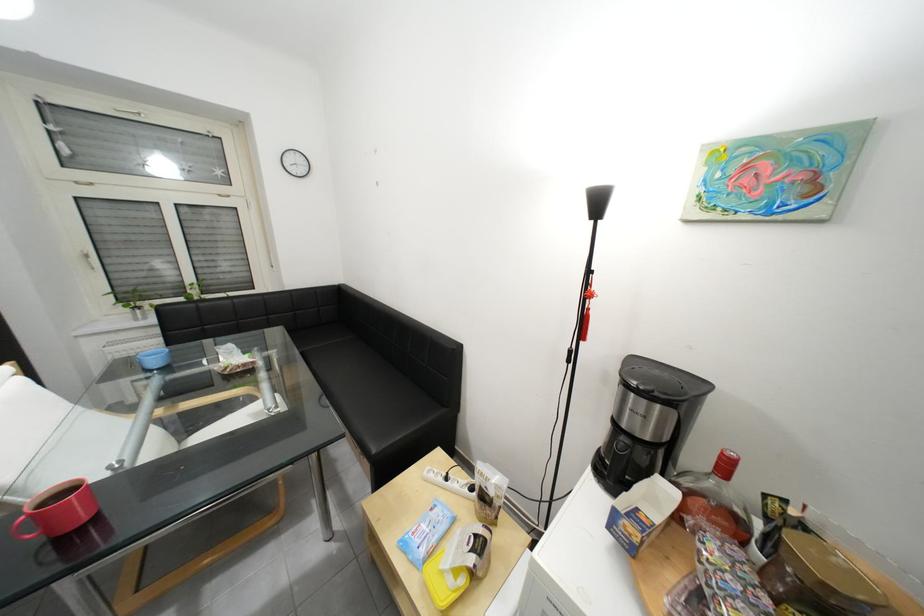
Find where to sit the sofa sitting surface. Please return your answer as a coordinate pair (x, y).

(366, 389)